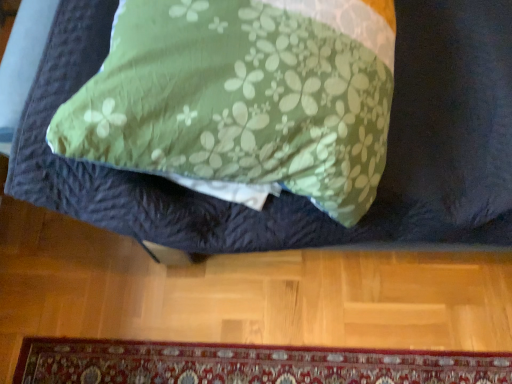
Question: In the image, is green floral fabric at center positioned in front of or behind carpeted mat at lower center?

Choices:
 (A) behind
 (B) front

Answer: (B)

Question: Is green floral fabric at center taller or shorter than carpeted mat at lower center?

Choices:
 (A) tall
 (B) short

Answer: (A)

Question: From the image's perspective, is green floral fabric at center above or below carpeted mat at lower center?

Choices:
 (A) above
 (B) below

Answer: (A)

Question: Does point (308, 360) appear closer or farther from the camera than point (435, 178)?

Choices:
 (A) farther
 (B) closer

Answer: (A)

Question: Based on their positions, is carpeted mat at lower center located to the left or right of green floral fabric at center?

Choices:
 (A) right
 (B) left

Answer: (B)

Question: In terms of height, does carpeted mat at lower center look taller or shorter compared to green floral fabric at center?

Choices:
 (A) tall
 (B) short

Answer: (B)

Question: Is carpeted mat at lower center situated inside green floral fabric at center or outside?

Choices:
 (A) inside
 (B) outside

Answer: (B)